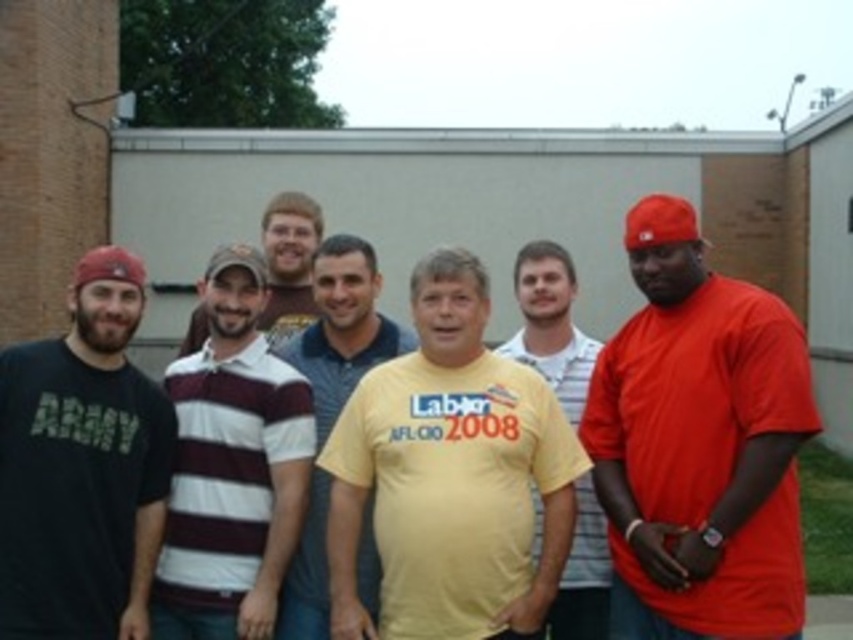
From the picture: Does maroon and white striped polo shirt at center appear over yellow matte shirt at center?

→ No, maroon and white striped polo shirt at center is not above yellow matte shirt at center.

Is point (196, 589) more distant than point (544, 371)?

No.

Find the location of `maroon and white striped polo shirt at center`. maroon and white striped polo shirt at center is located at coordinates (231, 467).

Between yellow matte t-shirt at center and maroon and white striped polo shirt at center, which one appears on the right side from the viewer's perspective?

From the viewer's perspective, yellow matte t-shirt at center appears more on the right side.

Between yellow matte t-shirt at center and maroon and white striped polo shirt at center, which one has less height?

yellow matte t-shirt at center

Which is in front, point (544, 468) or point (202, 451)?

Point (544, 468)

I want to click on yellow matte t-shirt at center, so click(x=450, y=476).

Can you confirm if yellow matte shirt at center is positioned above matte brown cap at center?

Incorrect, yellow matte shirt at center is not positioned above matte brown cap at center.

Describe the element at coordinates (550, 324) in the screenshot. The height and width of the screenshot is (640, 853). I see `yellow matte shirt at center` at that location.

This screenshot has height=640, width=853. Identify the location of yellow matte shirt at center. (550, 324).